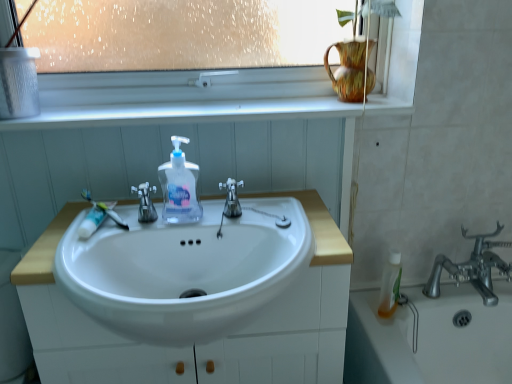
At what (x,y) coordinates should I click in order to perform the action: click on free location in front of white plastic toothbrush at left. Please return your answer as a coordinate pair (x, y). The image size is (512, 384). Looking at the image, I should click on (77, 246).